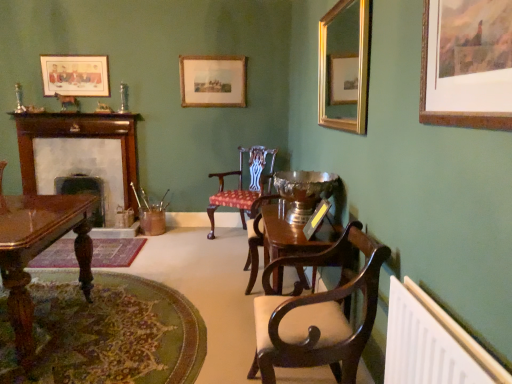
You are a GUI agent. You are given a task and a screenshot of the screen. Output one action in this format:
    pyautogui.click(x=<x>, y=<y>)
    Task: Click on the vacant region under mahogany wood chair with upholstered seat at center, which ranks as the second chair in front-to-back order (from a real-world perspective)
    This screenshot has height=384, width=512.
    Given the screenshot: What is the action you would take?
    pyautogui.click(x=231, y=236)